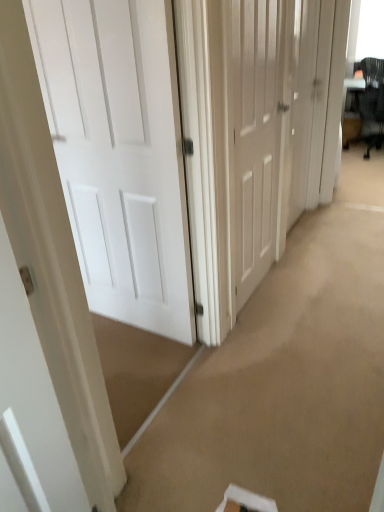
Question: Considering the relative sizes of white matte door at center, the first door when ordered from left to right, and white matte door at center, which ranks as the 2th door in right-to-left order, in the image provided, is white matte door at center, the first door when ordered from left to right, bigger than white matte door at center, which ranks as the 2th door in right-to-left order,?

Choices:
 (A) no
 (B) yes

Answer: (B)

Question: Is white matte door at center, positioned as the third door in right-to-left order, further to the viewer compared to white matte door at center, the second door when ordered from left to right?

Choices:
 (A) yes
 (B) no

Answer: (B)

Question: Can you confirm if white matte door at center, the first door when ordered from left to right, is thinner than white matte door at center, which ranks as the 2th door in right-to-left order?

Choices:
 (A) no
 (B) yes

Answer: (A)

Question: From a real-world perspective, is white matte door at center, the first door when ordered from left to right, located beneath white matte door at center, which ranks as the 2th door in right-to-left order?

Choices:
 (A) yes
 (B) no

Answer: (A)

Question: Considering the relative positions of white matte door at center, positioned as the third door in right-to-left order, and white matte door at center, which ranks as the 2th door in right-to-left order, in the image provided, is white matte door at center, positioned as the third door in right-to-left order, to the right of white matte door at center, which ranks as the 2th door in right-to-left order, from the viewer's perspective?

Choices:
 (A) yes
 (B) no

Answer: (B)

Question: Is white matte door at center, the first door positioned from the right, bigger or smaller than black mesh swivel chair at upper right?

Choices:
 (A) small
 (B) big

Answer: (A)

Question: Considering the relative positions of white matte door at center, the first door positioned from the right, and black mesh swivel chair at upper right in the image provided, is white matte door at center, the first door positioned from the right, to the left or to the right of black mesh swivel chair at upper right?

Choices:
 (A) right
 (B) left

Answer: (B)

Question: Is white matte door at center, which ranks as the 3th door in left-to-right order, in front of or behind black mesh swivel chair at upper right in the image?

Choices:
 (A) front
 (B) behind

Answer: (A)

Question: Is point (309, 74) positioned closer to the camera than point (372, 103)?

Choices:
 (A) farther
 (B) closer

Answer: (B)

Question: Is white matte door at center, positioned as the third door in right-to-left order, bigger or smaller than white matte door at center, which ranks as the 3th door in left-to-right order?

Choices:
 (A) big
 (B) small

Answer: (A)

Question: In the image, is white matte door at center, positioned as the third door in right-to-left order, positioned in front of or behind white matte door at center, which ranks as the 3th door in left-to-right order?

Choices:
 (A) front
 (B) behind

Answer: (A)

Question: Considering the positions of white matte door at center, the first door when ordered from left to right, and white matte door at center, the first door positioned from the right, in the image, is white matte door at center, the first door when ordered from left to right, taller or shorter than white matte door at center, the first door positioned from the right,?

Choices:
 (A) tall
 (B) short

Answer: (B)

Question: Considering the positions of white matte door at center, the first door when ordered from left to right, and white matte door at center, the first door positioned from the right, in the image, is white matte door at center, the first door when ordered from left to right, wider or thinner than white matte door at center, the first door positioned from the right,?

Choices:
 (A) wide
 (B) thin

Answer: (A)

Question: From their relative heights in the image, would you say white matte door at center, which ranks as the 3th door in left-to-right order, is taller or shorter than white matte door at center, which ranks as the 2th door in right-to-left order?

Choices:
 (A) short
 (B) tall

Answer: (B)

Question: Is white matte door at center, the first door positioned from the right, bigger or smaller than white matte door at center, the second door when ordered from left to right?

Choices:
 (A) big
 (B) small

Answer: (B)